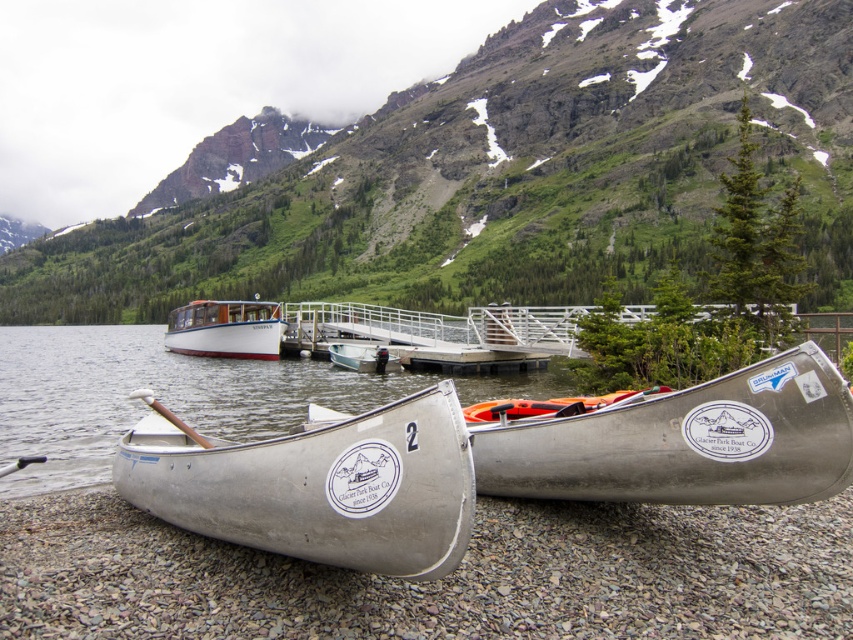
Question: Where is brushed metal mountain at upper center located in relation to metallic silver canoe at center in the image?

Choices:
 (A) right
 (B) left

Answer: (B)

Question: Which point is closer to the camera taking this photo?

Choices:
 (A) (595, 288)
 (B) (792, 483)

Answer: (B)

Question: Is silver metallic canoe at lower right above metallic silver canoe at center?

Choices:
 (A) yes
 (B) no

Answer: (B)

Question: Which point is farther from the camera taking this photo?

Choices:
 (A) (679, 420)
 (B) (271, 497)
 (C) (438, 224)
 (D) (363, 356)

Answer: (C)

Question: Considering the real-world distances, which object is closest to the silver metallic canoe at lower center?

Choices:
 (A) brushed metal mountain at upper center
 (B) metallic silver canoe at center
 (C) white polished wood boat at center
 (D) silver metallic canoe at lower right

Answer: (D)

Question: Is silver metallic canoe at lower right closer to the viewer compared to metallic silver canoe at center?

Choices:
 (A) yes
 (B) no

Answer: (A)